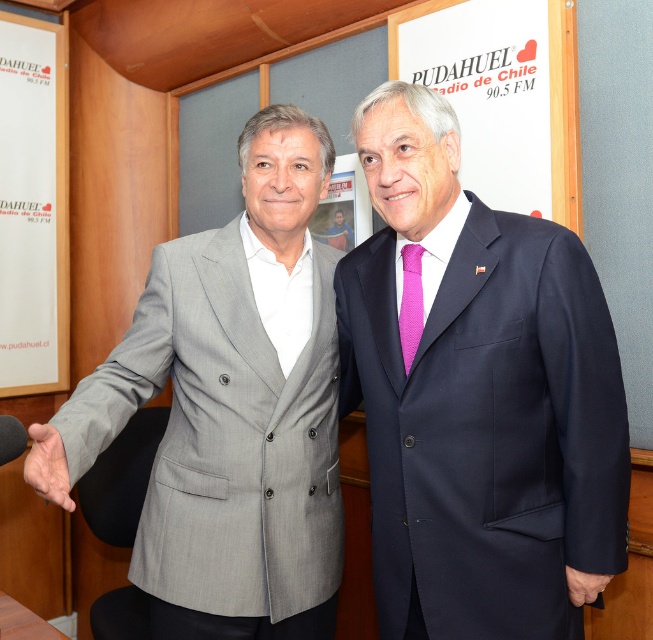
Question: Is gray wool suit at center smaller than matte black hand at lower right?

Choices:
 (A) no
 (B) yes

Answer: (A)

Question: Which point is farther to the camera?

Choices:
 (A) gray wool suit at center
 (B) dark blue suit at center

Answer: (B)

Question: Which point appears closest to the camera in this image?

Choices:
 (A) (57, 196)
 (B) (35, 429)

Answer: (B)

Question: Which point is closer to the camera?

Choices:
 (A) smooth skin hand at center
 (B) dark blue suit at center

Answer: (A)

Question: Is white paperboard at left smaller than matte gray suit at center?

Choices:
 (A) yes
 (B) no

Answer: (B)

Question: Can you confirm if white paperboard at left is smaller than pink dotted tie at center?

Choices:
 (A) no
 (B) yes

Answer: (A)